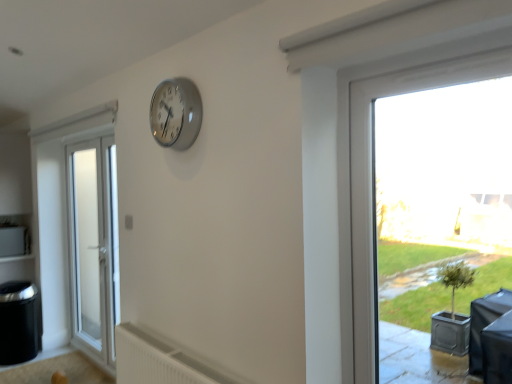
Question: In the image, is transparent glass window at right on the left side or the right side of white plastic radiator at lower center?

Choices:
 (A) left
 (B) right

Answer: (B)

Question: Choose the correct answer: Is transparent glass window at right inside white plastic radiator at lower center or outside it?

Choices:
 (A) inside
 (B) outside

Answer: (B)

Question: Which of these objects is positioned farthest from the white frosted glass door at left?

Choices:
 (A) silver metallic clock at upper center
 (B) transparent glass window at right
 (C) white plastic radiator at lower center

Answer: (B)

Question: Which of these objects is positioned closest to the white plastic radiator at lower center?

Choices:
 (A) white frosted glass door at left
 (B) transparent glass window at right
 (C) silver metallic clock at upper center

Answer: (B)